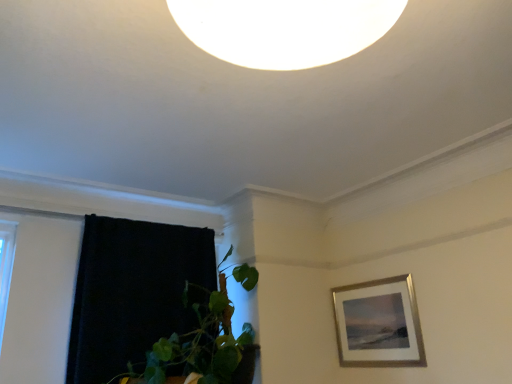
Question: Is black velvet curtain at left taller than silver/metallic picture frame at upper right?

Choices:
 (A) yes
 (B) no

Answer: (A)

Question: From the image's perspective, does black velvet curtain at left appear lower than silver/metallic picture frame at upper right?

Choices:
 (A) yes
 (B) no

Answer: (B)

Question: Is black velvet curtain at left in front of silver/metallic picture frame at upper right?

Choices:
 (A) no
 (B) yes

Answer: (B)

Question: Are black velvet curtain at left and silver/metallic picture frame at upper right beside each other?

Choices:
 (A) no
 (B) yes

Answer: (A)

Question: Does black velvet curtain at left have a greater width compared to silver/metallic picture frame at upper right?

Choices:
 (A) yes
 (B) no

Answer: (A)

Question: Is silver/metallic picture frame at upper right situated inside green leafy plant at lower left or outside?

Choices:
 (A) inside
 (B) outside

Answer: (B)

Question: From a real-world perspective, is silver/metallic picture frame at upper right above or below green leafy plant at lower left?

Choices:
 (A) above
 (B) below

Answer: (B)

Question: Would you say silver/metallic picture frame at upper right is to the left or to the right of green leafy plant at lower left in the picture?

Choices:
 (A) left
 (B) right

Answer: (B)

Question: Does point pyautogui.click(x=344, y=331) appear closer or farther from the camera than point pyautogui.click(x=117, y=379)?

Choices:
 (A) farther
 (B) closer

Answer: (A)

Question: Relative to black velvet curtain at left, is silver/metallic picture frame at upper right in front or behind?

Choices:
 (A) behind
 (B) front

Answer: (A)

Question: Does point (376, 336) appear closer or farther from the camera than point (201, 264)?

Choices:
 (A) closer
 (B) farther

Answer: (A)

Question: Looking at their shapes, would you say silver/metallic picture frame at upper right is wider or thinner than black velvet curtain at left?

Choices:
 (A) wide
 (B) thin

Answer: (B)

Question: From the image's perspective, is silver/metallic picture frame at upper right above or below black velvet curtain at left?

Choices:
 (A) above
 (B) below

Answer: (B)

Question: Would you say green leafy plant at lower left is inside or outside silver/metallic picture frame at upper right?

Choices:
 (A) outside
 (B) inside

Answer: (A)

Question: Considering the positions of green leafy plant at lower left and silver/metallic picture frame at upper right in the image, is green leafy plant at lower left taller or shorter than silver/metallic picture frame at upper right?

Choices:
 (A) short
 (B) tall

Answer: (B)